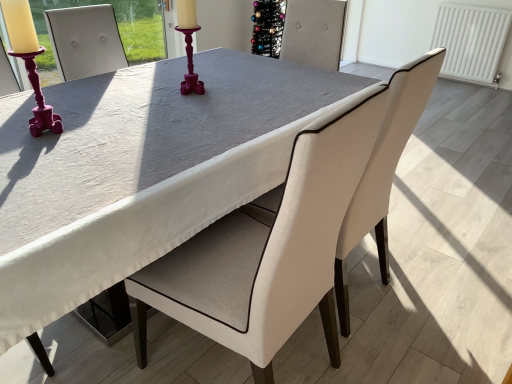
This screenshot has width=512, height=384. I want to click on free spot to the left of matte pink candlestick at left, so click(17, 129).